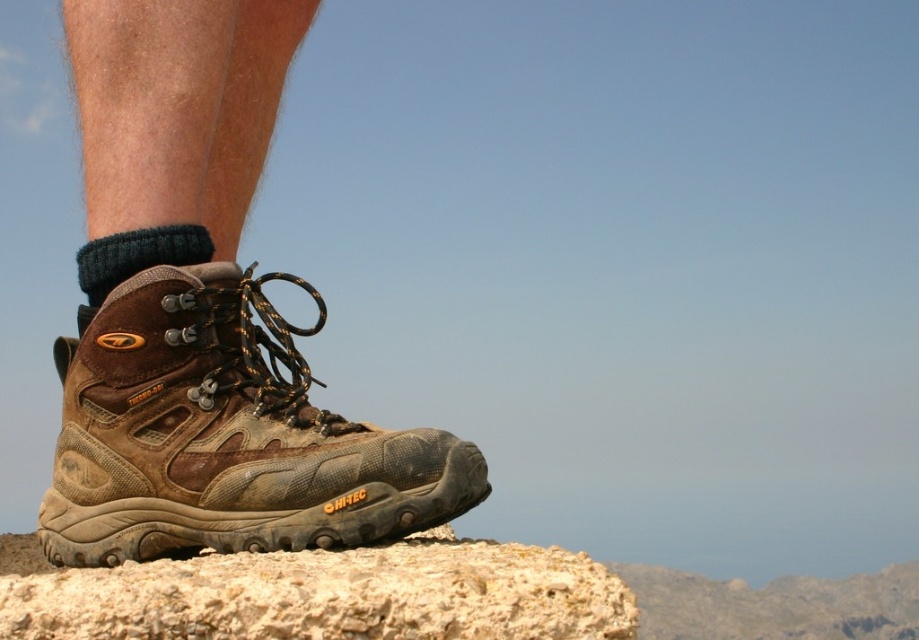
Question: Is brown textured rock at lower left thinner than dark blue knitted sock at lower left?

Choices:
 (A) no
 (B) yes

Answer: (A)

Question: Which point is farther to the camera?

Choices:
 (A) (135, 417)
 (B) (621, 602)

Answer: (A)

Question: Which object is farther from the camera taking this photo?

Choices:
 (A) brown leather boot at lower left
 (B) dark blue knitted sock at lower left
 (C) brown textured rock at lower left

Answer: (B)

Question: Which point is closer to the camera taking this photo?

Choices:
 (A) (305, 618)
 (B) (247, 508)
 (C) (177, 241)

Answer: (A)

Question: Is brown leather boot at lower left thinner than dark blue knitted sock at lower left?

Choices:
 (A) yes
 (B) no

Answer: (B)

Question: Can you confirm if brown leather boot at lower left is positioned above brown textured rock at lower left?

Choices:
 (A) yes
 (B) no

Answer: (A)